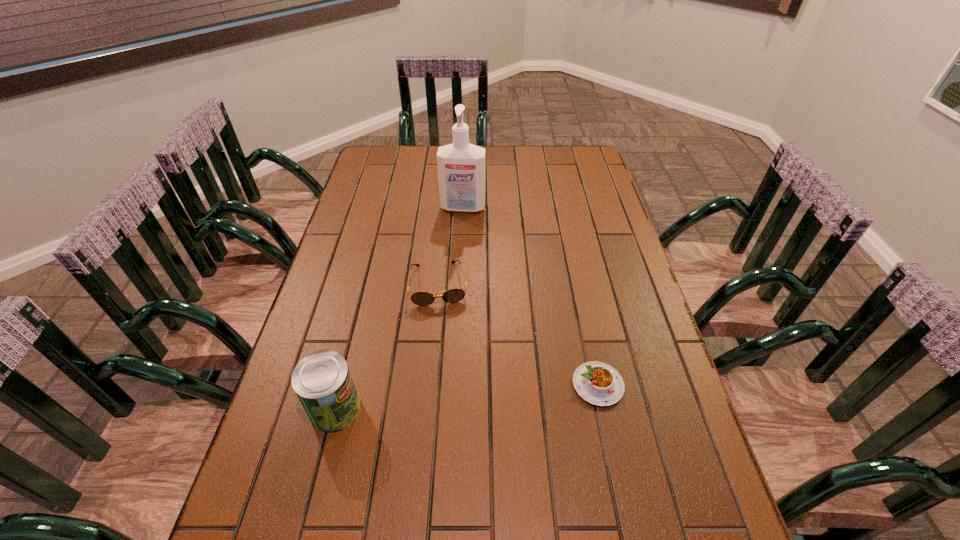
Find the location of `free space on the desktop that is between the leftmost object and the rightmost object and is positioned on the front label of the farthest object`. free space on the desktop that is between the leftmost object and the rightmost object and is positioned on the front label of the farthest object is located at coordinates coord(432,400).

This screenshot has width=960, height=540. In order to click on vacant space on the desktop that is between the leftmost object and the shortest object and is positioned on the lenses of the second farthest object in this screenshot , I will do `click(449, 399)`.